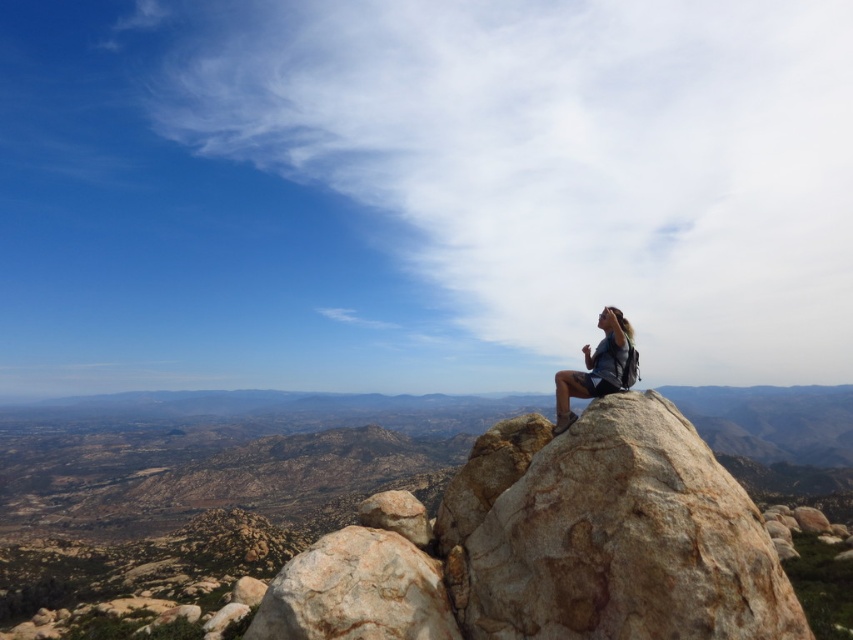
From the picture: You are a hiker trying to place your dark gray backpack at center on top of the brown rough rock at upper center. Can you do this based on their positions?

The brown rough rock at upper center is below the dark gray backpack at center, so the backpack is already positioned on top of the rock.

You are a hiker standing on the rocky outcrop and want to place your backpack on the nearest rock. Which rock should you choose between the brown rough rock at upper center and the other rocks in the scene?

The brown rough rock at upper center is located at point (210,474), so it is the nearest rock to your current position on the rocky outcrop. You should place your backpack on the brown rough rock at upper center.

Based on the photo, you are a hiker trying to cross the rocky outcrop. You see the brown rough rock at upper center and the rough textured rock at center. Which rock should you step on first if you want to climb higher?

The brown rough rock at upper center has a larger size compared to the rough textured rock at center, so stepping on it first would provide a more stable base for climbing higher.